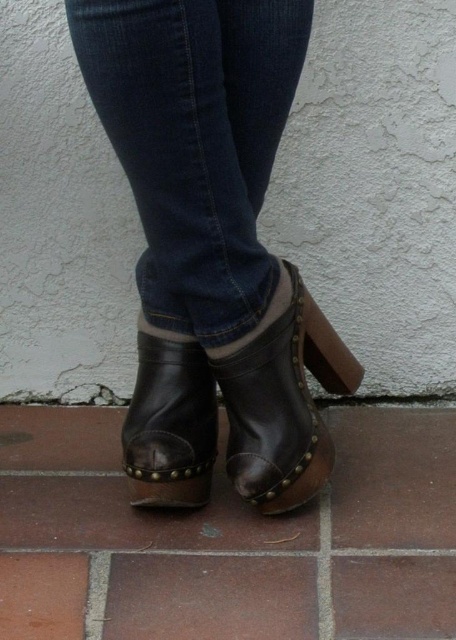
Between dark blue denim jeans at center and leather boot at lower center, which one has less height?

Standing shorter between the two is leather boot at lower center.

Is point (98, 1) closer to viewer compared to point (134, 465)?

Yes, point (98, 1) is in front of point (134, 465).

Identify the location of dark blue denim jeans at center. (196, 141).

Between point (145, 6) and point (221, 385), which one is positioned in front?

Point (145, 6) is more forward.

Between point (155, 104) and point (231, 412), which one is positioned behind?

The point (231, 412) is behind.

The width and height of the screenshot is (456, 640). Identify the location of dark blue denim jeans at center. (196, 141).

Can you confirm if leather boot at center is smaller than leather boot at lower center?

Actually, leather boot at center might be larger than leather boot at lower center.

Is point (262, 490) positioned before point (188, 413)?

Yes, it is in front of point (188, 413).

This screenshot has width=456, height=640. Find the location of `leather boot at center`. leather boot at center is located at coordinates (283, 403).